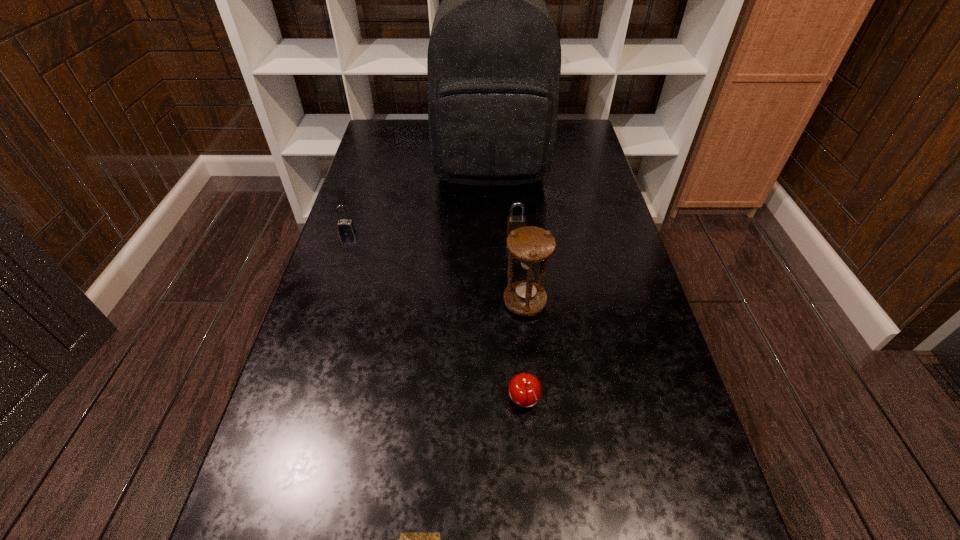
Find the location of a particular element. Image resolution: width=960 pixels, height=540 pixels. free area in between the cherry and the leftmost object is located at coordinates (436, 318).

The image size is (960, 540). Identify the location of vacant area that lies between the hourglass and the rightmost padlock. [x=520, y=267].

You are a GUI agent. You are given a task and a screenshot of the screen. Output one action in this format:
    pyautogui.click(x=<x>, y=<y>)
    Task: Click on the vacant space that is in between the fifth shortest object and the backpack
    
    Given the screenshot: What is the action you would take?
    pyautogui.click(x=508, y=235)

What are the coordinates of `free space between the tallest object and the leftmost padlock` in the screenshot? It's located at (420, 201).

Locate which object ranks third in proximity to the fifth farthest object. Please provide its 2D coordinates. Your answer should be formatted as a tuple, i.e. [(x, y)], where the tuple contains the x and y coordinates of a point satisfying the conditions above.

[(513, 221)]

Locate an element on the screen. Image resolution: width=960 pixels, height=540 pixels. object that is the closest to the fourth farthest object is located at coordinates click(x=525, y=390).

At what (x,y) coordinates should I click in order to perform the action: click on the closest padlock to the rightmost padlock. Please return your answer as a coordinate pair (x, y). This screenshot has height=540, width=960. Looking at the image, I should click on (346, 227).

Identify the location of the closest padlock to the farthest object. (513, 221).

You are a GUI agent. You are given a task and a screenshot of the screen. Output one action in this format:
    pyautogui.click(x=<x>, y=<y>)
    Task: Click on the vacant position in the image that satisfies the following two spatial constraints: 1. on the shackle of the cherry; 2. on the right side of the leftmost padlock
    
    Given the screenshot: What is the action you would take?
    pyautogui.click(x=294, y=402)

Where is `vacant position in the image that satisfies the following two spatial constraints: 1. on the shackle of the leftmost object; 2. on the right side of the fifth farthest object`? The height and width of the screenshot is (540, 960). vacant position in the image that satisfies the following two spatial constraints: 1. on the shackle of the leftmost object; 2. on the right side of the fifth farthest object is located at coordinates (294, 402).